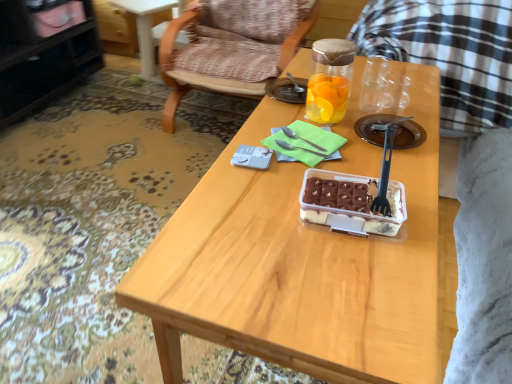
The width and height of the screenshot is (512, 384). In order to click on vacant space behind satin silver fork at center, the second fork in the front-to-back sequence in this screenshot , I will do `click(296, 120)`.